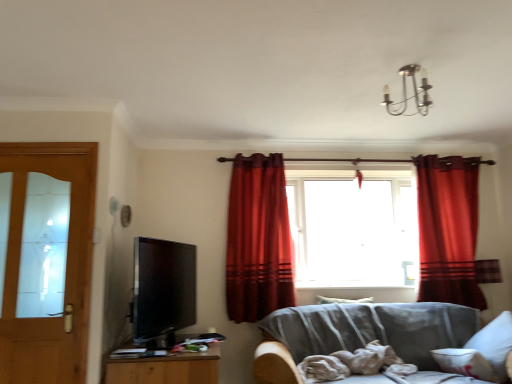
This screenshot has width=512, height=384. Identify the location of free point above light brown wooden door at left (from a real-world perspective). (42, 149).